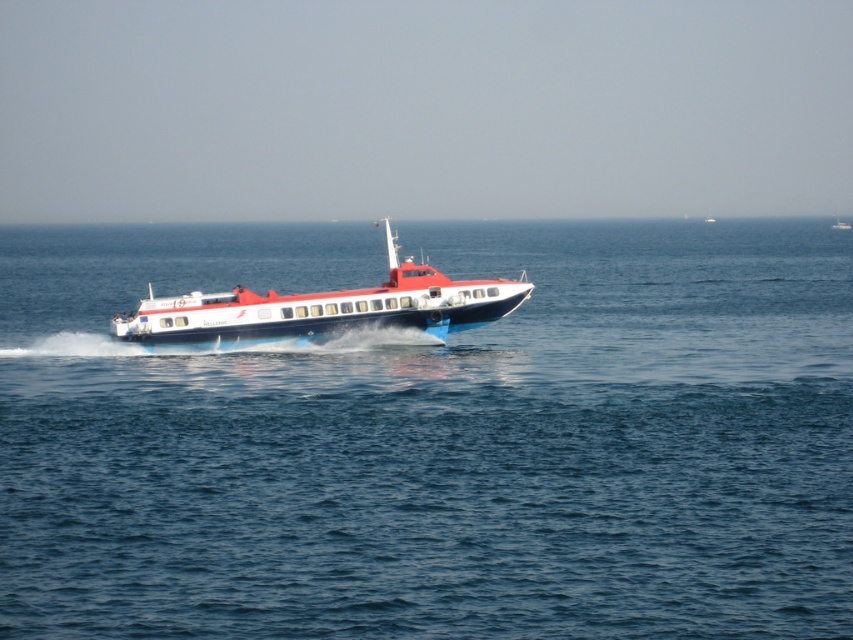
Is blue water at center shorter than shiny blue and white boat at center?

→ No.

Which of these two, blue water at center or shiny blue and white boat at center, stands shorter?

shiny blue and white boat at center

Is point (590, 522) less distant than point (265, 298)?

Yes, point (590, 522) is closer to viewer.

Where is `blue water at center`? blue water at center is located at coordinates (434, 440).